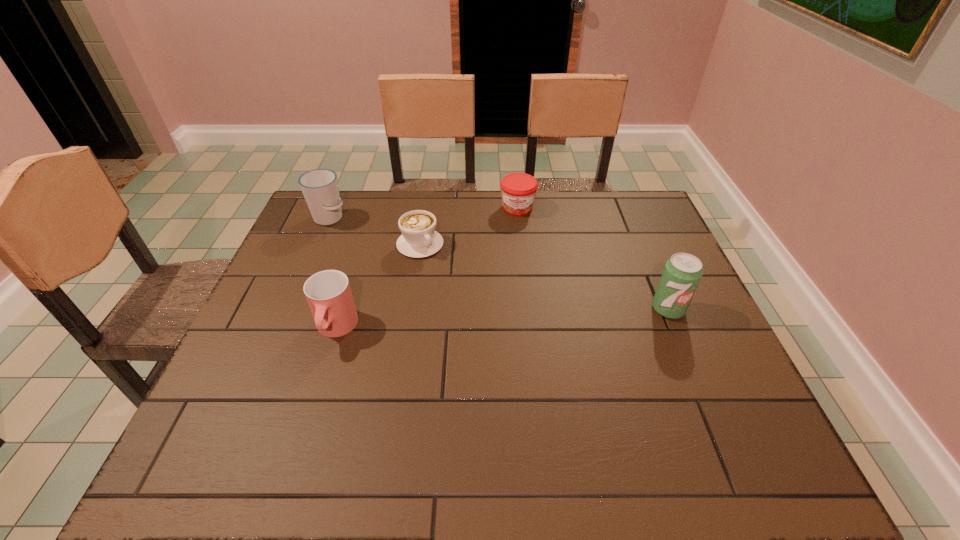
Locate an element on the screen. The height and width of the screenshot is (540, 960). the right cup is located at coordinates (328, 293).

In order to click on the nearer cup in this screenshot , I will do `click(328, 293)`.

Locate an element on the screen. Image resolution: width=960 pixels, height=540 pixels. soda is located at coordinates (682, 273).

Where is `the third object from left to right`? Image resolution: width=960 pixels, height=540 pixels. the third object from left to right is located at coordinates (419, 239).

The height and width of the screenshot is (540, 960). Identify the location of the third nearest object. (419, 239).

Find the location of a particular element. The height and width of the screenshot is (540, 960). jam is located at coordinates (518, 190).

The image size is (960, 540). I want to click on the farther cup, so click(x=320, y=188).

I want to click on the leftmost object, so click(320, 188).

The width and height of the screenshot is (960, 540). I want to click on vacant space situated on the side of the right cup with the handle, so 315,395.

Locate an element on the screen. The width and height of the screenshot is (960, 540). free region located on the back of the soda is located at coordinates (638, 240).